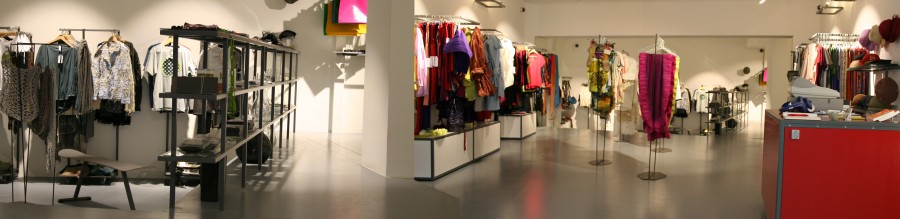
You are a GUI agent. You are given a task and a screenshot of the screen. Output one action in this format:
    pyautogui.click(x=<x>, y=<y>)
    Task: Click on the overhead lighting
    The height and width of the screenshot is (219, 900).
    Given the screenshot: What is the action you would take?
    pyautogui.click(x=490, y=6), pyautogui.click(x=825, y=9)